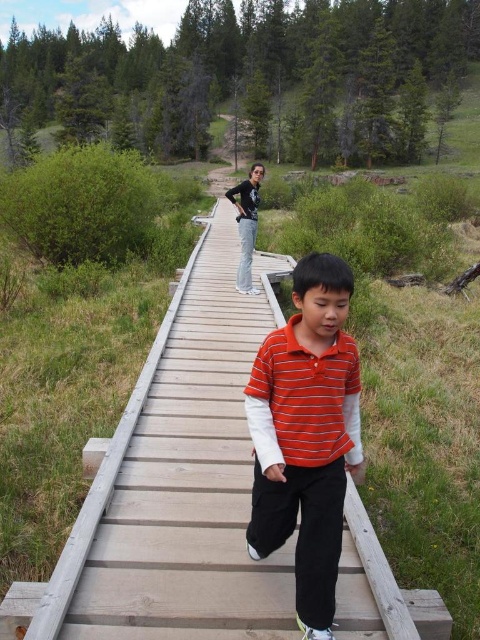
Question: Which object appears farthest from the camera in this image?

Choices:
 (A) orange striped shirt at center
 (B) black cotton pants at center

Answer: (B)

Question: Which of the following is the closest to the observer?

Choices:
 (A) orange striped shirt at center
 (B) black cotton pants at center

Answer: (A)

Question: Is wooden bridge at center closer to camera compared to black cotton pants at center?

Choices:
 (A) no
 (B) yes

Answer: (B)

Question: Can you confirm if wooden bridge at center is bigger than orange striped shirt at center?

Choices:
 (A) no
 (B) yes

Answer: (B)

Question: Is wooden bridge at center to the right of orange striped shirt at center from the viewer's perspective?

Choices:
 (A) yes
 (B) no

Answer: (B)

Question: Which of the following is the farthest from the observer?

Choices:
 (A) orange striped shirt at center
 (B) black cotton pants at center

Answer: (B)